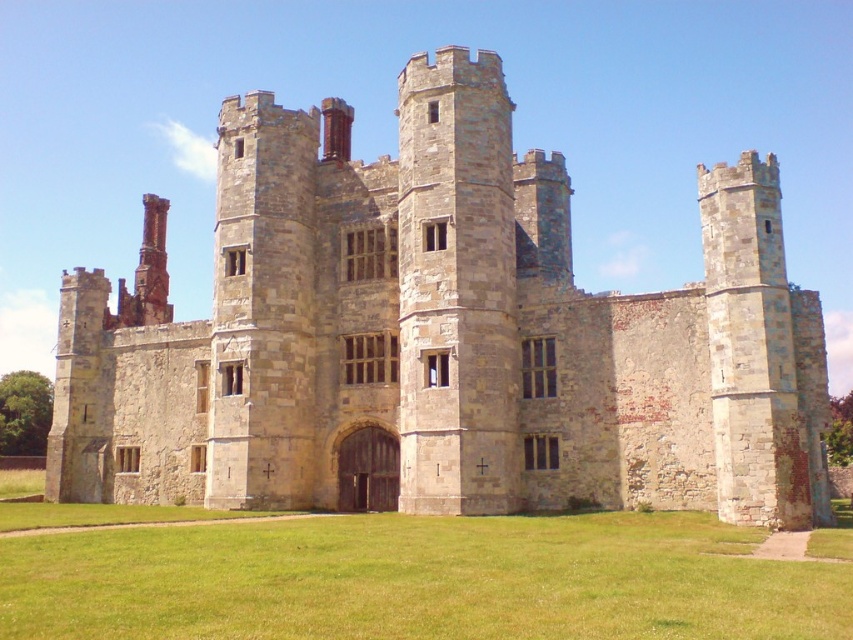
Is the position of stone castle at center more distant than that of green grass at center?

Yes.

Who is higher up, stone castle at center or green grass at center?

stone castle at center

Who is more forward, (260, 440) or (738, 548)?

Point (738, 548) is in front.

The image size is (853, 640). I want to click on stone castle at center, so click(x=440, y=337).